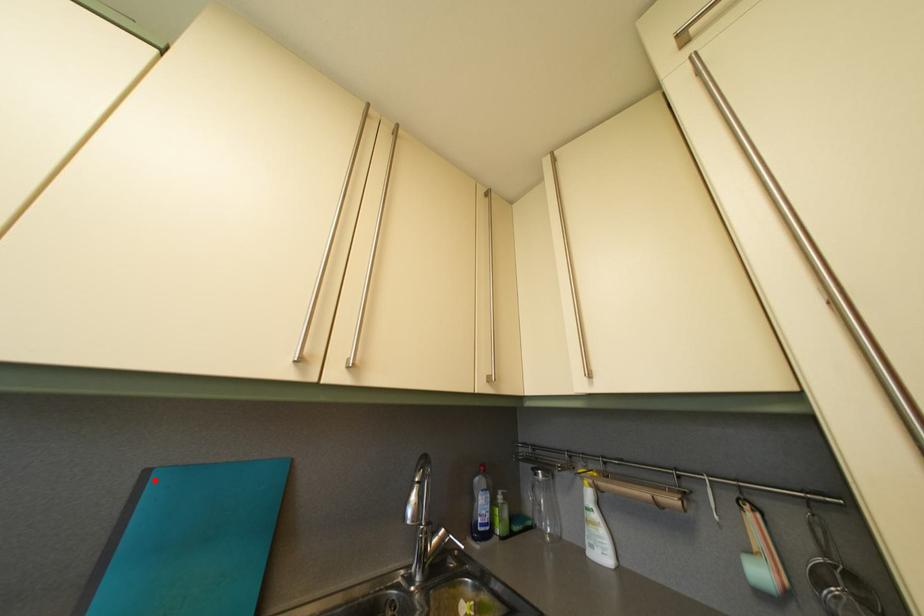
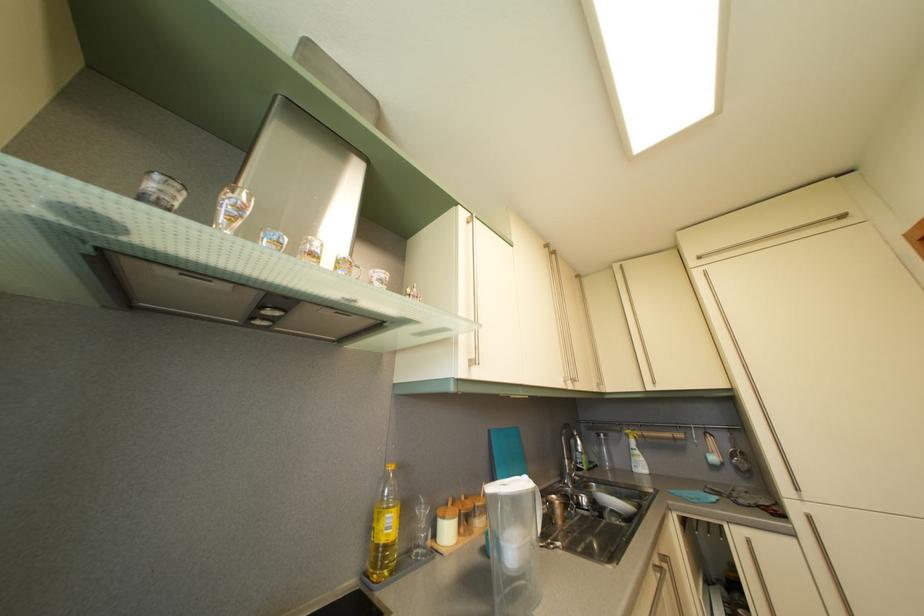
Find the pixel in the second image that matches the highlighted location in the first image.

(497, 439)